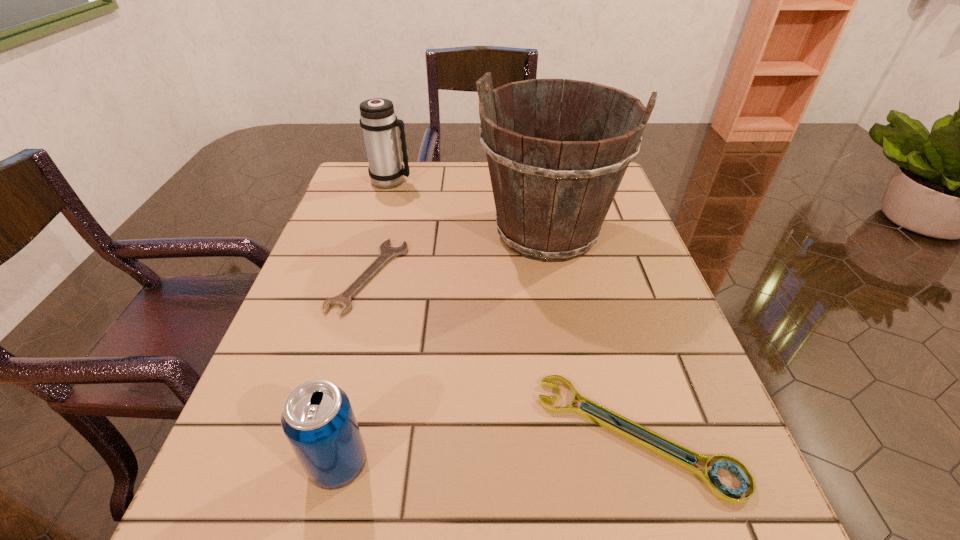
Where is `empty space that is in between the bucket and the second tallest object`? This screenshot has height=540, width=960. empty space that is in between the bucket and the second tallest object is located at coordinates click(x=469, y=207).

Identify the location of vacant region between the bucket and the farther wrench. This screenshot has width=960, height=540. (458, 254).

The width and height of the screenshot is (960, 540). In order to click on unoccupied position between the farther wrench and the thermos bottle in this screenshot , I will do `click(380, 228)`.

This screenshot has height=540, width=960. In order to click on free space between the pop soda and the farthest object in this screenshot , I will do `click(365, 322)`.

Locate an element on the screen. This screenshot has width=960, height=540. free space between the bucket and the left wrench is located at coordinates (458, 254).

You are a GUI agent. You are given a task and a screenshot of the screen. Output one action in this format:
    pyautogui.click(x=<x>, y=<y>)
    Task: Click on the vacant space that's between the nearer wrench and the farthest object
    Image resolution: width=960 pixels, height=540 pixels.
    Given the screenshot: What is the action you would take?
    pyautogui.click(x=514, y=308)

Identify which object is located as the fourth nearest to the farther wrench. Please provide its 2D coordinates. Your answer should be formatted as a tuple, i.e. [(x, y)], where the tuple contains the x and y coordinates of a point satisfying the conditions above.

[(719, 490)]

The height and width of the screenshot is (540, 960). Find the location of `object that can be found as the closest to the third tallest object`. object that can be found as the closest to the third tallest object is located at coordinates (343, 300).

Identify the location of free location that satisfies the following two spatial constraints: 1. on the side with the handle of the fourth shortest object; 2. on the back side of the third shortest object. Image resolution: width=960 pixels, height=540 pixels. (307, 463).

Image resolution: width=960 pixels, height=540 pixels. Identify the location of free point that satisfies the following two spatial constraints: 1. on the back side of the pop soda; 2. on the left side of the nearer wrench. (346, 435).